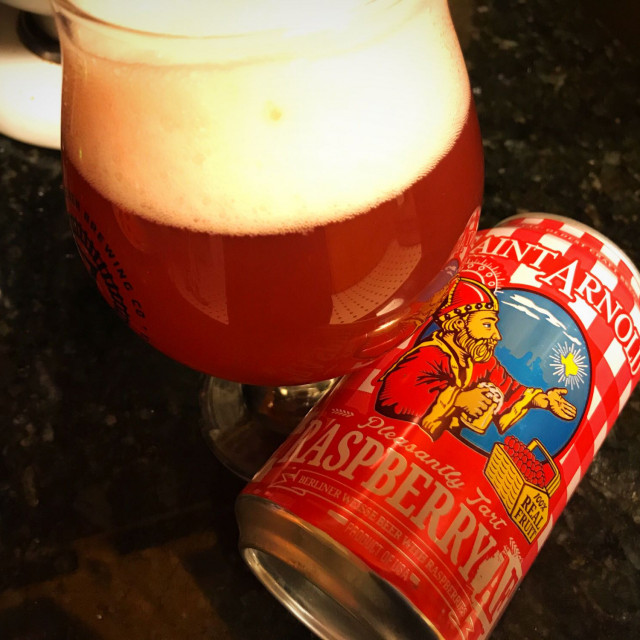
Image resolution: width=640 pixels, height=640 pixels. What are the coordinates of `glass stem` in the screenshot? It's located at (292, 397).